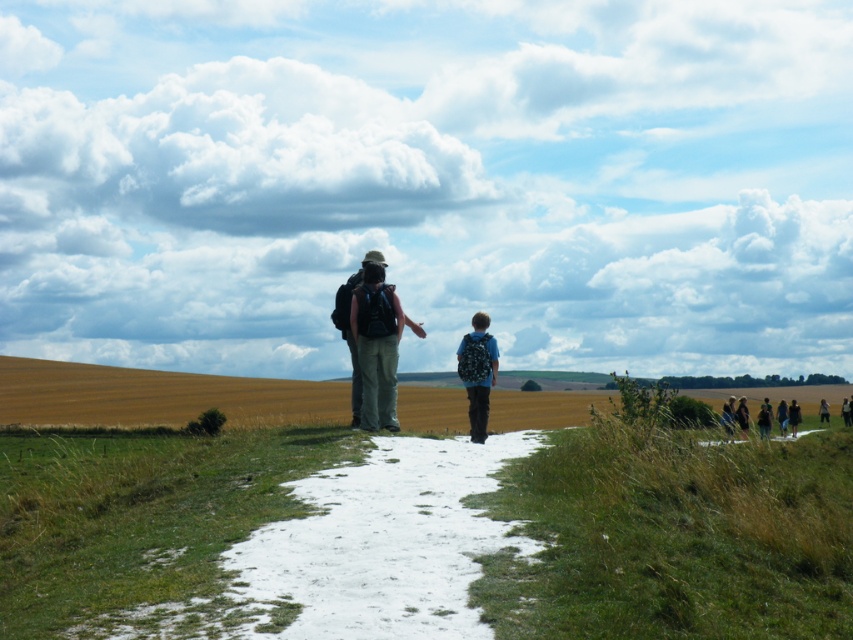
You are standing on the grassy path and want to pick up the white snow at center and the matte blue backpack at center. Which object is closer to you?

The white snow at center is 5.59 meters away from the matte blue backpack at center, so it depends on your position. However, since both are at center, you might need to check the exact distance from your current spot.

You are a photographer trying to capture a photo of the golden wheat field at center and the matte black backpack at center. Which object should you focus on if you want to highlight the one that appears taller in the image?

The golden wheat field at center is taller than the matte black backpack at center, so you should focus on the golden wheat field at center to highlight its height.

You are standing at the starting point of a hiking trail and see the image. There is a white snow at center located at point (381,545). Can you walk directly to that point without stepping on any grass?

The white snow at center is located at point (381,545). Since the path is grassy and bordered by grass, you would have to step on grass to reach that point.